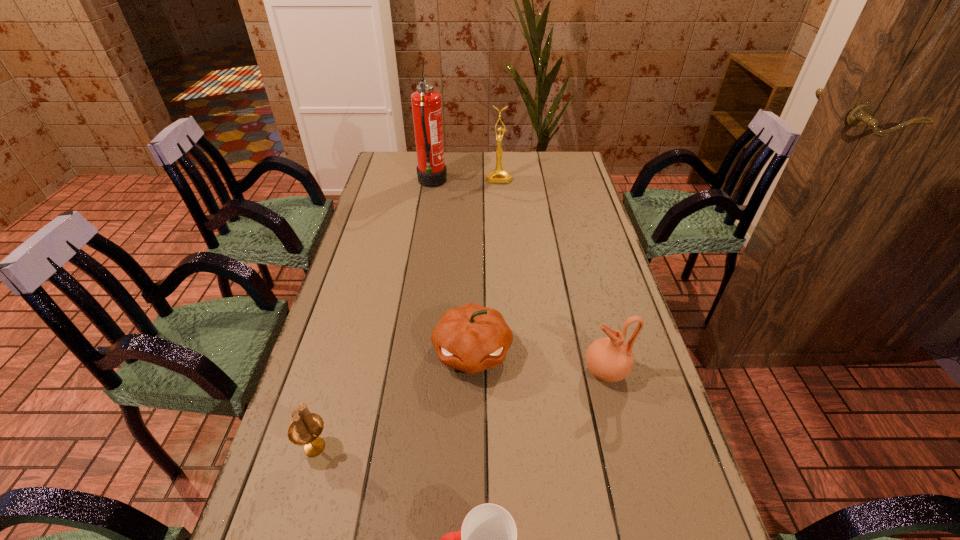
You are a GUI agent. You are given a task and a screenshot of the screen. Output one action in this format:
    pyautogui.click(x=<x>, y=<y>)
    Task: Click on the fire extinguisher
    
    Given the screenshot: What is the action you would take?
    pyautogui.click(x=426, y=103)

The height and width of the screenshot is (540, 960). I want to click on the tallest object, so click(x=426, y=103).

Locate an element on the screen. award is located at coordinates (498, 175).

You are a GUI agent. You are given a task and a screenshot of the screen. Output one action in this format:
    pyautogui.click(x=<x>, y=<y>)
    Task: Click on the pottery
    This screenshot has width=960, height=540.
    Given the screenshot: What is the action you would take?
    pyautogui.click(x=609, y=359)

You are a GUI agent. You are given a task and a screenshot of the screen. Output one action in this format:
    pyautogui.click(x=<x>, y=<y>)
    Task: Click on the leftmost object
    
    Given the screenshot: What is the action you would take?
    pyautogui.click(x=305, y=429)

Locate an element on the screen. candle holder is located at coordinates (305, 429).

Find the location of a particular element. pumpkin is located at coordinates (471, 338).

I want to click on free space located on the front-facing side of the fire extinguisher, so click(544, 183).

Locate an element on the screen. The height and width of the screenshot is (540, 960). vacant space situated 0.080m on the front-facing side of the fifth shortest object is located at coordinates (500, 194).

Where is `vacant space situated on the spout of the pottery`? vacant space situated on the spout of the pottery is located at coordinates 470,371.